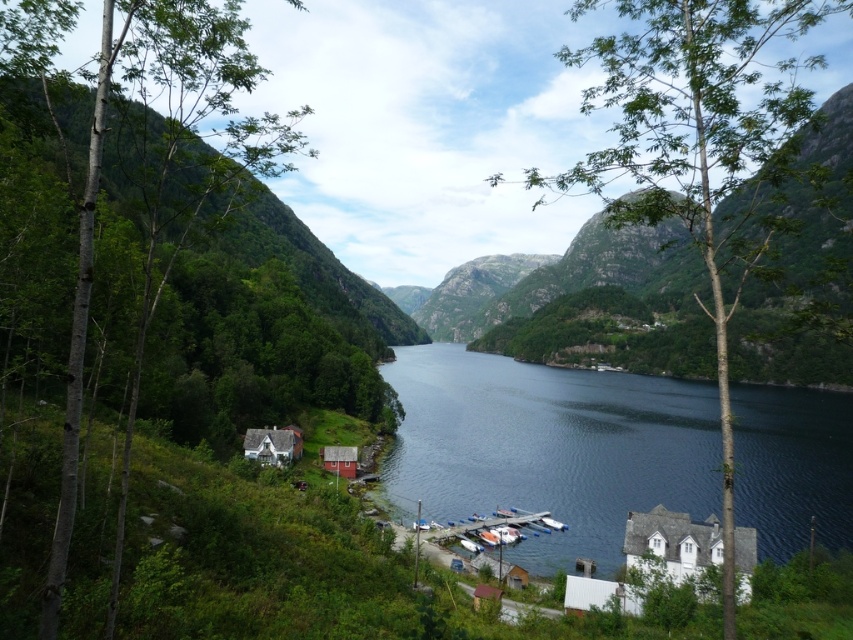
Question: Is dark blue water at center thinner than white wooden house at lower left?

Choices:
 (A) no
 (B) yes

Answer: (A)

Question: Which of the following is the farthest from the observer?

Choices:
 (A) (328, 465)
 (B) (750, 67)
 (C) (408, 352)

Answer: (B)

Question: Considering the relative positions of green leafy tree at center and green leafy tree at left in the image provided, where is green leafy tree at center located with respect to green leafy tree at left?

Choices:
 (A) below
 (B) above

Answer: (B)

Question: Estimate the real-world distances between objects in this image. Which object is farther from the green leafy tree at left?

Choices:
 (A) wooden cabin at lower center
 (B) white wooden hut at lower right
 (C) green leafy tree at center
 (D) white wooden house at lower right

Answer: (C)

Question: Does dark blue water at center appear over white wooden hut at lower right?

Choices:
 (A) no
 (B) yes

Answer: (B)

Question: Which point is farther to the camera?

Choices:
 (A) (346, 470)
 (B) (634, 592)
 (C) (415, 353)
 (D) (291, 445)

Answer: (C)